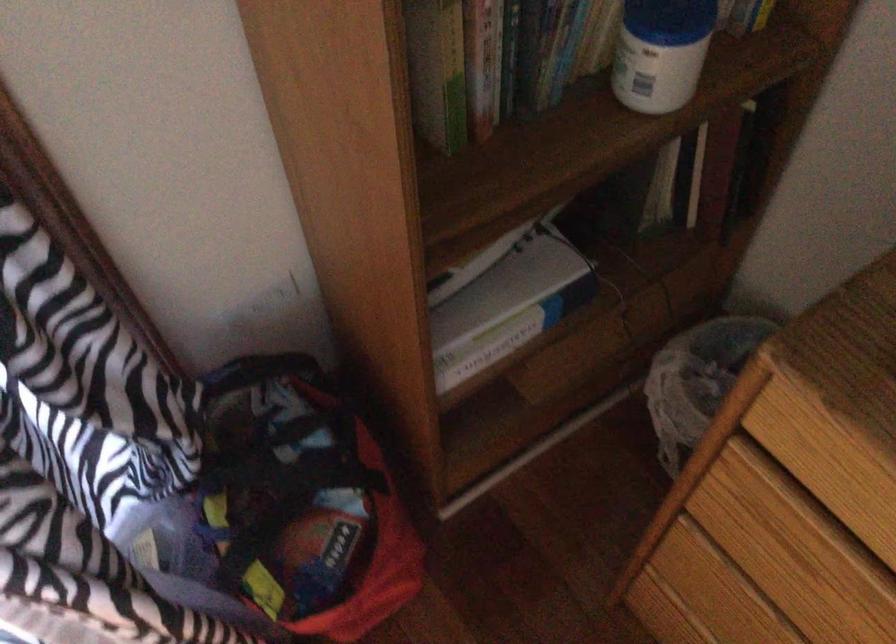
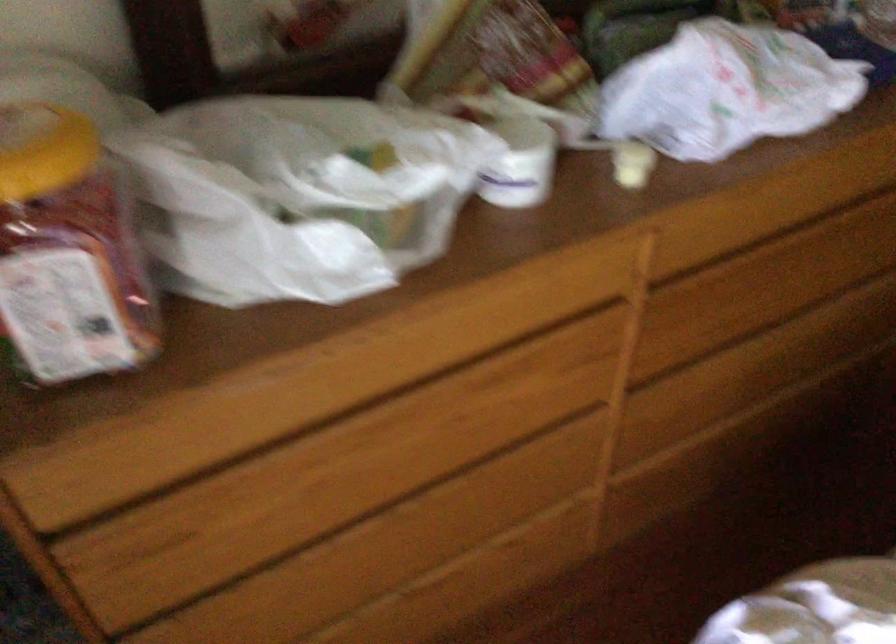
How did the camera likely rotate?

The camera's rotation is toward right-down.